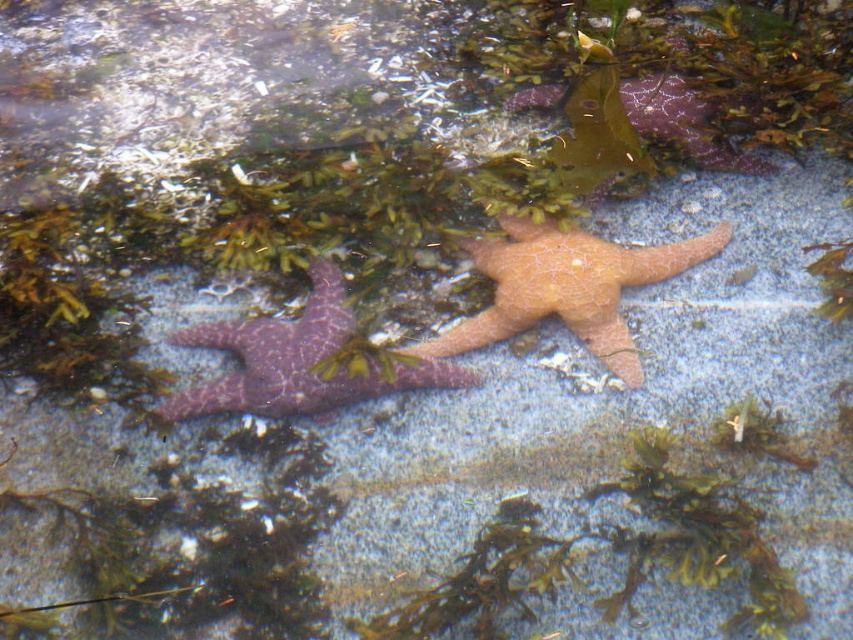
You are a marine biologist observing the underwater scene. You notice the orange matte starfish at center and the purple matte starfish at center. Which one is positioned higher in the water column?

The orange matte starfish at center is positioned higher in the water column because it is above the purple matte starfish at center.

You are a marine biologist studying the spatial arrangement of marine life in a tide pool. You observe the orange matte starfish at center. Based on its coordinates, can you determine its position relative to the center of the image?

The orange matte starfish at center is located at point 0.450 on the x axis and 0.664 on the y axis, which places it slightly to the right and below the center of the image.